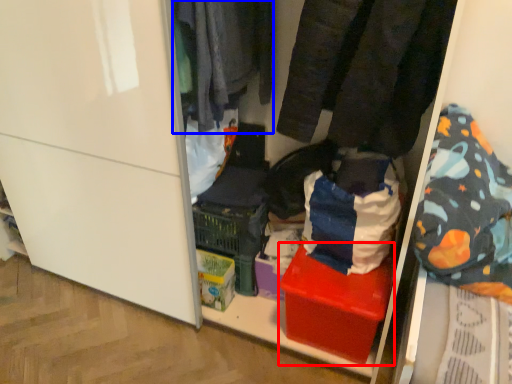
Question: Which object appears closest to the camera in this image, box (highlighted by a red box) or clothing (highlighted by a blue box)?

Choices:
 (A) box
 (B) clothing

Answer: (B)